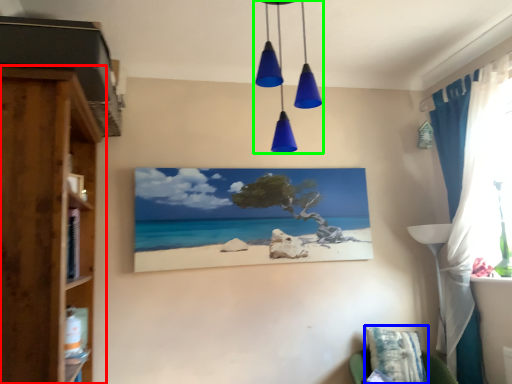
Question: Estimate the real-world distances between objects in this image. Which object is farther from cupboard (highlighted by a red box), pillow (highlighted by a blue box) or light fixture (highlighted by a green box)?

Choices:
 (A) pillow
 (B) light fixture

Answer: (A)